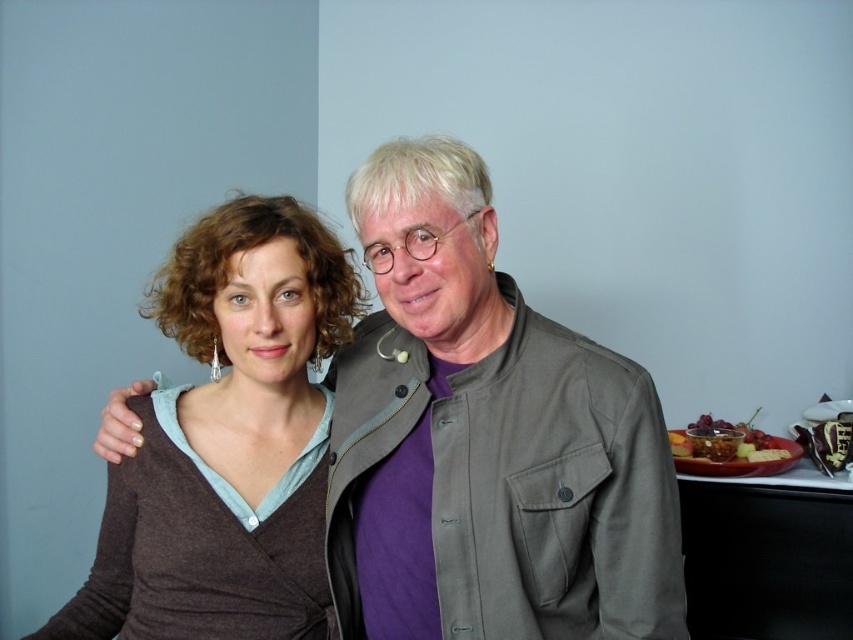
Can you confirm if matte gray jacket at center is wider than brown matte sweater at center?

Indeed, matte gray jacket at center has a greater width compared to brown matte sweater at center.

Can you confirm if matte gray jacket at center is positioned below brown matte sweater at center?

No.

Find the location of `matte gray jacket at center`. matte gray jacket at center is located at coordinates (486, 440).

Image resolution: width=853 pixels, height=640 pixels. I want to click on matte gray jacket at center, so click(x=486, y=440).